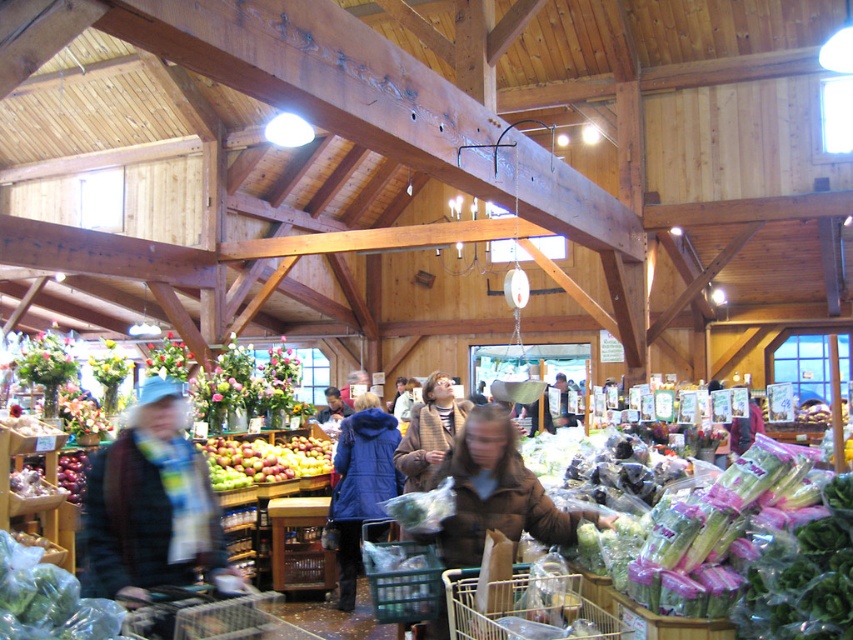
Who is positioned more to the right, blue woolen scarf at left or brown fuzzy coat at center?

brown fuzzy coat at center is more to the right.

Can you confirm if blue woolen scarf at left is wider than brown fuzzy coat at center?

In fact, blue woolen scarf at left might be narrower than brown fuzzy coat at center.

Which is behind, point (160, 468) or point (462, 456)?

The point (462, 456) is behind.

Where is `blue woolen scarf at left`? This screenshot has width=853, height=640. blue woolen scarf at left is located at coordinates (149, 506).

From the picture: Who is higher up, blue matte coat at center or green matte apples at center?

green matte apples at center is higher up.

Between blue matte coat at center and green matte apples at center, which one appears on the left side from the viewer's perspective?

Positioned to the left is green matte apples at center.

The width and height of the screenshot is (853, 640). I want to click on blue matte coat at center, so [x=361, y=484].

At what (x,y) coordinates should I click in order to perform the action: click on blue matte coat at center. Please return your answer as a coordinate pair (x, y). This screenshot has height=640, width=853. Looking at the image, I should click on (361, 484).

Between brown fuzzy coat at center and metallic wire basket at lower center, which one is positioned higher?

brown fuzzy coat at center

Does brown fuzzy coat at center appear on the left side of metallic wire basket at lower center?

Correct, you'll find brown fuzzy coat at center to the left of metallic wire basket at lower center.

The width and height of the screenshot is (853, 640). In order to click on brown fuzzy coat at center in this screenshot , I will do `click(495, 493)`.